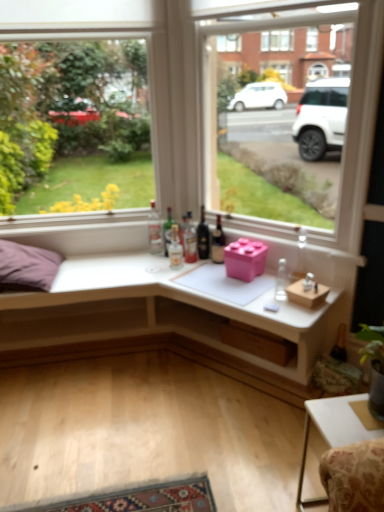
What is the approximate height of wooden at lower center, which appears as the third window box when viewed from the top?

6.61 inches.

You are a GUI agent. You are given a task and a screenshot of the screen. Output one action in this format:
    pyautogui.click(x=<x>, y=<y>)
    Task: Click on the wooden box at right, the 2th window box in the bottom-to-top sequence
    The height and width of the screenshot is (512, 384).
    Given the screenshot: What is the action you would take?
    pyautogui.click(x=306, y=294)

Locate an element on the screen. The width and height of the screenshot is (384, 512). dark glass bottle at center, the 2th bottle positioned from the right is located at coordinates (218, 243).

From the clear glass bottle at center, the 7th bottle positioned from the right, count 2nd window boxs forward and point to it. Please provide its 2D coordinates.

[(245, 259)]

How different are the orientations of pink matte plastic cube at center, which appears as the 1th window box when viewed from the top, and clear glass bottle at center, the 7th bottle positioned from the right, in degrees?

There is a 34.5-degree angle between the facing directions of pink matte plastic cube at center, which appears as the 1th window box when viewed from the top, and clear glass bottle at center, the 7th bottle positioned from the right.

From the image's perspective, which is above, pink matte plastic cube at center, positioned as the third window box in bottom-to-top order, or clear glass bottle at center, the 7th bottle positioned from the right?

clear glass bottle at center, the 7th bottle positioned from the right, appears higher in the image.

Consider the image. Between pink matte plastic cube at center, positioned as the third window box in bottom-to-top order, and clear glass bottle at center, the 7th bottle positioned from the right, which one has smaller width?

Thinner between the two is clear glass bottle at center, the 7th bottle positioned from the right.

Does point (4, 270) come farther from viewer compared to point (151, 203)?

That is False.

Between purple fabric pillow at left and clear glass bottle at center, the 7th bottle positioned from the right, which one has smaller width?

clear glass bottle at center, the 7th bottle positioned from the right.

What's the angular difference between purple fabric pillow at left and clear glass bottle at center, which appears as the first bottle when viewed from the left,'s facing directions?

12.5 degrees.

From a real-world perspective, does clear glass bottle at center, the 7th bottle positioned from the right, stand above transparent glass window at upper center, which is counted as the second window, starting from the right?

No.

Looking at this image, is clear glass bottle at center, which appears as the first bottle when viewed from the left, to the left or to the right of transparent glass window at upper center, which is counted as the second window, starting from the right, in the image?

clear glass bottle at center, which appears as the first bottle when viewed from the left, is to the right of transparent glass window at upper center, which is counted as the second window, starting from the right.

Is transparent glass window at upper center, which is counted as the second window, starting from the right, a part of clear glass bottle at center, the 7th bottle positioned from the right?

No, transparent glass window at upper center, which is counted as the second window, starting from the right, is not a part of clear glass bottle at center, the 7th bottle positioned from the right.

Considering the relative positions of clear glass bottle at center, which appears as the first bottle when viewed from the left, and transparent glass window at upper center, which is counted as the second window, starting from the right, in the image provided, is clear glass bottle at center, which appears as the first bottle when viewed from the left, in front of transparent glass window at upper center, which is counted as the second window, starting from the right,?

No, clear glass bottle at center, which appears as the first bottle when viewed from the left, is behind transparent glass window at upper center, which is counted as the second window, starting from the right.

Find the location of a particular element. pillow to the left of translucent glass bottle at center, the 5th bottle when ordered from right to left is located at coordinates (27, 267).

Considering the positions of objects translucent glass bottle at center, the 5th bottle when ordered from right to left, and purple fabric pillow at left in the image provided, who is more to the right, translucent glass bottle at center, the 5th bottle when ordered from right to left, or purple fabric pillow at left?

translucent glass bottle at center, the 5th bottle when ordered from right to left.

Do you think translucent glass bottle at center, marked as the 3th bottle in a left-to-right arrangement, is within purple fabric pillow at left, or outside of it?

translucent glass bottle at center, marked as the 3th bottle in a left-to-right arrangement, exists outside the volume of purple fabric pillow at left.

Is translucent glass bottle at center, marked as the 3th bottle in a left-to-right arrangement, closer to camera compared to purple fabric pillow at left?

No, translucent glass bottle at center, marked as the 3th bottle in a left-to-right arrangement, is behind purple fabric pillow at left.

Is dark glass bottle at center, the 2th bottle positioned from the right, not inside transparent glass window at center, which ranks as the 1th window in right-to-left order?

Indeed, dark glass bottle at center, the 2th bottle positioned from the right, is completely outside transparent glass window at center, which ranks as the 1th window in right-to-left order.

From a real-world perspective, which window is the 1st one above the dark glass bottle at center, the 2th bottle positioned from the right? Please provide its 2D coordinates.

[(282, 106)]

Does dark glass bottle at center, the 6th bottle viewed from the left, have a lesser width compared to transparent glass window at center, which ranks as the 1th window in right-to-left order?

Correct, the width of dark glass bottle at center, the 6th bottle viewed from the left, is less than that of transparent glass window at center, which ranks as the 1th window in right-to-left order.

Is wooden box at right, which appears as the 2th window box when viewed from the top, wider or thinner than transparent glass window at center, marked as the second window in a left-to-right arrangement?

wooden box at right, which appears as the 2th window box when viewed from the top, is thinner than transparent glass window at center, marked as the second window in a left-to-right arrangement.

Is wooden box at right, the 2th window box in the bottom-to-top sequence, bigger than transparent glass window at center, marked as the second window in a left-to-right arrangement?

Incorrect, wooden box at right, the 2th window box in the bottom-to-top sequence, is not larger than transparent glass window at center, marked as the second window in a left-to-right arrangement.

How far apart are wooden box at right, which appears as the 2th window box when viewed from the top, and transparent glass window at center, marked as the second window in a left-to-right arrangement?

wooden box at right, which appears as the 2th window box when viewed from the top, is 5.69 feet away from transparent glass window at center, marked as the second window in a left-to-right arrangement.

Would you say wooden box at right, the 2th window box in the bottom-to-top sequence, is outside transparent glass window at center, marked as the second window in a left-to-right arrangement?

That's correct, wooden box at right, the 2th window box in the bottom-to-top sequence, is outside of transparent glass window at center, marked as the second window in a left-to-right arrangement.

Is pink matte plastic cube at center, which appears as the 1th window box when viewed from the top, oriented away from dark glass bottle at center, positioned as the 3th bottle in right-to-left order?

pink matte plastic cube at center, which appears as the 1th window box when viewed from the top, does not have its back to dark glass bottle at center, positioned as the 3th bottle in right-to-left order.

Is the surface of pink matte plastic cube at center, positioned as the third window box in bottom-to-top order, in direct contact with dark glass bottle at center, positioned as the 3th bottle in right-to-left order?

No.

Consider the image. Can dark glass bottle at center, which is the 5th bottle in left-to-right order, be found inside pink matte plastic cube at center, which appears as the 1th window box when viewed from the top?

Actually, dark glass bottle at center, which is the 5th bottle in left-to-right order, is outside pink matte plastic cube at center, which appears as the 1th window box when viewed from the top.

Considering the sizes of objects pink matte plastic cube at center, which appears as the 1th window box when viewed from the top, and dark glass bottle at center, which is the 5th bottle in left-to-right order, in the image provided, who is bigger, pink matte plastic cube at center, which appears as the 1th window box when viewed from the top, or dark glass bottle at center, which is the 5th bottle in left-to-right order,?

pink matte plastic cube at center, which appears as the 1th window box when viewed from the top.

Starting from the clear glass bottle at center, which appears as the first bottle when viewed from the left, which window box is the 2nd one in front? Please provide its 2D coordinates.

[(245, 259)]

From the purple fabric pillow at left, count 1st bottle to the right and point to it. Please provide its 2D coordinates.

[(154, 231)]

Consider the image. Based on their spatial positions, is translucent glass bottle at center, marked as the sixth bottle in a right-to-left arrangement, or wooden at lower center, the first window box positioned from the bottom, closer to purple fabric pillow at left?

The object closer to purple fabric pillow at left is translucent glass bottle at center, marked as the sixth bottle in a right-to-left arrangement.

Looking at the image, which one is located closer to dark glass bottle at center, positioned as the 3th bottle in right-to-left order, wooden at lower center, the first window box positioned from the bottom, or translucent glass bottle at center, marked as the sixth bottle in a right-to-left arrangement?

The object closer to dark glass bottle at center, positioned as the 3th bottle in right-to-left order, is translucent glass bottle at center, marked as the sixth bottle in a right-to-left arrangement.

Considering their positions, is transparent glass window at upper center, which appears as the first window when viewed from the left, positioned closer to clear glass bottle at center, which appears as the first bottle when viewed from the left, than transparent glass window at center, which ranks as the 1th window in right-to-left order?

The object closer to clear glass bottle at center, which appears as the first bottle when viewed from the left, is transparent glass window at upper center, which appears as the first window when viewed from the left.

Which object lies further to the anchor point dark glass bottle at center, positioned as the 3th bottle in right-to-left order, pink matte plastic cube at center, positioned as the third window box in bottom-to-top order, or transparent glass window at upper center, which appears as the first window when viewed from the left?

transparent glass window at upper center, which appears as the first window when viewed from the left.

Looking at the image, which one is located further to translucent glass bottle at center, the 4th bottle viewed from the right, purple fabric pillow at left or transparent glass window at upper center, which appears as the first window when viewed from the left?

The object further to translucent glass bottle at center, the 4th bottle viewed from the right, is transparent glass window at upper center, which appears as the first window when viewed from the left.

When comparing their distances from wooden at lower center, the first window box positioned from the bottom, does white matte desk at center or white glossy table at lower right seem closer?

Among the two, white matte desk at center is located nearer to wooden at lower center, the first window box positioned from the bottom.

Looking at the image, which one is located closer to dark glass bottle at center, which is the 5th bottle in left-to-right order, purple fabric pillow at left or white glossy table at lower right?

Based on the image, purple fabric pillow at left appears to be nearer to dark glass bottle at center, which is the 5th bottle in left-to-right order.

Looking at the image, which one is located closer to white glossy table at lower right, clear glass bottle at center, positioned as the 7th bottle in left-to-right order, or white matte desk at center?

clear glass bottle at center, positioned as the 7th bottle in left-to-right order, is closer to white glossy table at lower right.

Identify the location of window situated between transparent glass window at upper center, which appears as the first window when viewed from the left, and clear glass bottle at center, positioned as the 7th bottle in left-to-right order, from left to right. The height and width of the screenshot is (512, 384). (282, 106).

This screenshot has width=384, height=512. I want to click on pillow between white matte desk at center and clear glass bottle at center, which appears as the first bottle when viewed from the left, from front to back, so click(x=27, y=267).

This screenshot has width=384, height=512. I want to click on desk located between purple fabric pillow at left and translucent glass bottle at center, acting as the fourth bottle starting from the left, in the left-right direction, so click(x=157, y=311).

I want to click on bottle between purple fabric pillow at left and translucent glass bottle at center, which ranks as the 2th bottle in left-to-right order, from left to right, so click(154, 231).